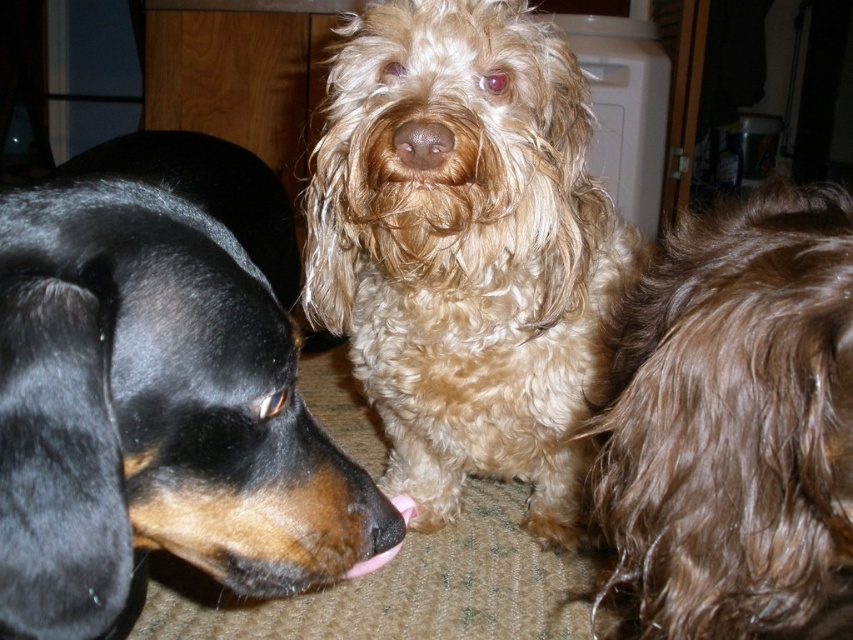
Question: Which of these objects is positioned closest to the fuzzy golden dog at center?

Choices:
 (A) brown curly fur at right
 (B) brown furry nose at center

Answer: (B)

Question: Estimate the real-world distances between objects in this image. Which object is farther from the fuzzy golden dog at center?

Choices:
 (A) brown furry nose at center
 (B) brown curly fur at right
 (C) black shiny coat at left

Answer: (C)

Question: Is fuzzy golden dog at center positioned at the back of brown curly fur at right?

Choices:
 (A) yes
 (B) no

Answer: (A)

Question: Which object is closer to the camera taking this photo?

Choices:
 (A) brown furry nose at center
 (B) black shiny coat at left
 (C) brown curly fur at right

Answer: (C)

Question: Does black shiny coat at left lie in front of brown furry nose at center?

Choices:
 (A) no
 (B) yes

Answer: (A)

Question: Does fuzzy golden dog at center come in front of brown curly fur at right?

Choices:
 (A) yes
 (B) no

Answer: (B)